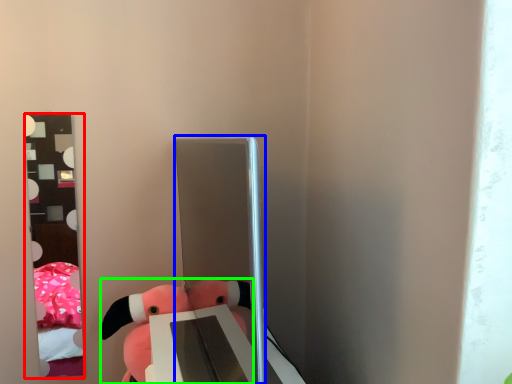
Question: Which is nearer to the mirror (highlighted by a red box)? glass door (highlighted by a blue box) or toy (highlighted by a green box).

Choices:
 (A) glass door
 (B) toy

Answer: (B)